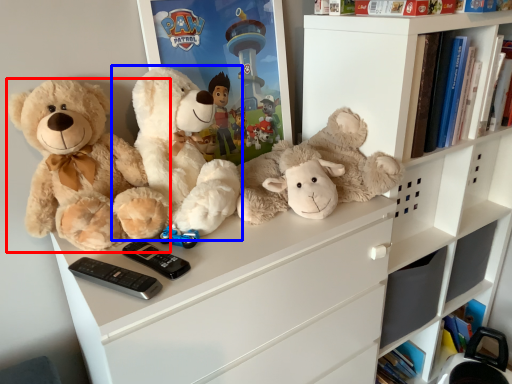
Question: Which of the following is the closest to the observer, teddy bear (highlighted by a red box) or teddy bear (highlighted by a blue box)?

Choices:
 (A) teddy bear
 (B) teddy bear

Answer: (A)